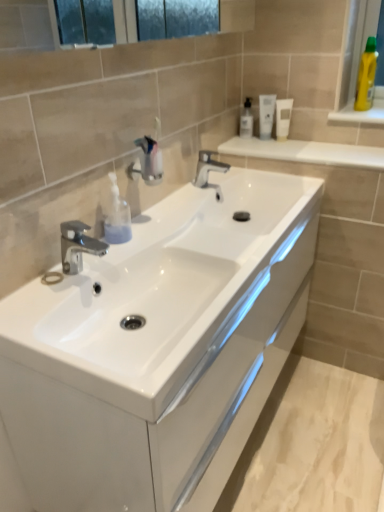
Question: From a real-world perspective, is metallic chrome faucet at center above or below polished chrome tap at left, which is the first tap in left-to-right order?

Choices:
 (A) above
 (B) below

Answer: (A)

Question: In the image, is metallic chrome faucet at center positioned in front of or behind polished chrome tap at left, the first tap in the bottom-to-top sequence?

Choices:
 (A) behind
 (B) front

Answer: (A)

Question: Estimate the real-world distances between objects in this image. Which object is farther from the polished chrome tap at left, the second tap from the right?

Choices:
 (A) white glossy tube at upper right, which is the 2th mouthwash from left to right
 (B) polished chrome tap at center, positioned as the 1th tap in back-to-front order
 (C) white matte tube at upper center, placed as the 1th mouthwash when sorted from right to left
 (D) metallic chrome faucet at center
 (E) clear plastic mouthwash at upper center, which appears as the first mouthwash when viewed from the left

Answer: (C)

Question: Based on their relative distances, which object is nearer to the clear plastic mouthwash at upper center, which is counted as the third mouthwash, starting from the right?

Choices:
 (A) yellow plastic bottle at upper right, the second toiletry viewed from the front
 (B) white matte tube at upper center, the third mouthwash positioned from the left
 (C) white glossy cabinet at center
 (D) polished chrome tap at left, which is counted as the 2th tap, starting from the back
 (E) white glossy shelf at upper right

Answer: (B)